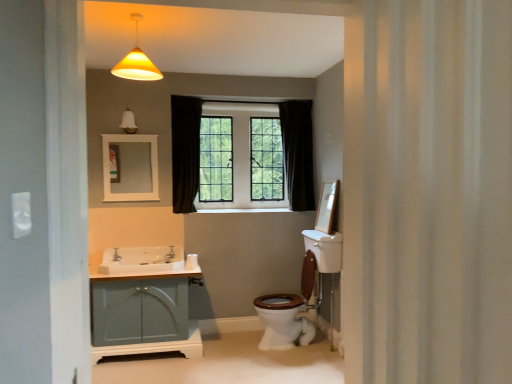
Find the location of a particular element. free spot in front of matte silver faucet at sink left, marked as the first faucet in a left-to-right arrangement is located at coordinates (114, 264).